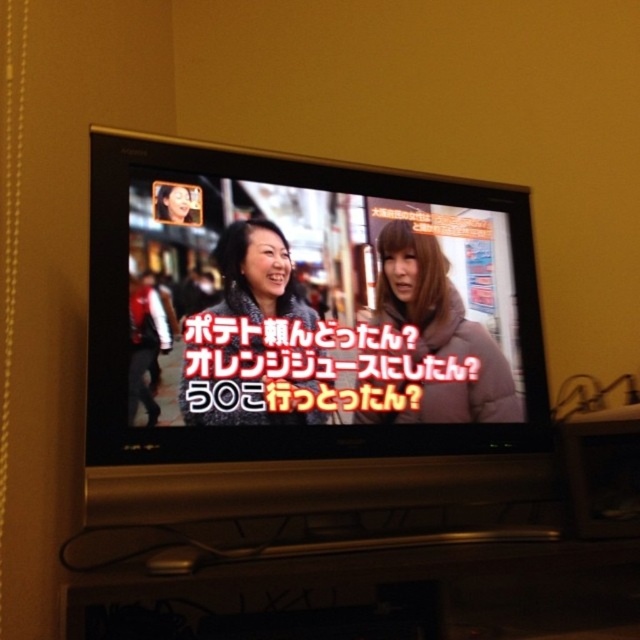
You are standing in a living room and want to place a new painting on the wall. The painting is 0.5 meters wide and you want it to be centered exactly where the matte black television at center is currently mounted. Can the painting fit in that space?

The matte black television at center is located at point (305, 308), so the painting can be centered there as long as there is enough space. However, the exact dimensions of the wall and the television are needed to confirm if the 0.5 meter wide painting will fit without overlapping other objects.

You are a delivery person who needs to place a small package on the floor in front of the matte gray jacket at center. The matte black television at center is in the way. Can you move the television to make space?

The matte black television at center is located above the matte gray jacket at center, so it is already positioned in a way that does not block the floor space in front of the jacket. You can place the package there without moving the television.

You are standing in front of the TV and want to know if the point at coordinates point (234, 232) is closer to you than point (321, 417). Can you determine this based on the TV screen?

Point (234, 232) is behind point (321, 417), so it is farther away from you.